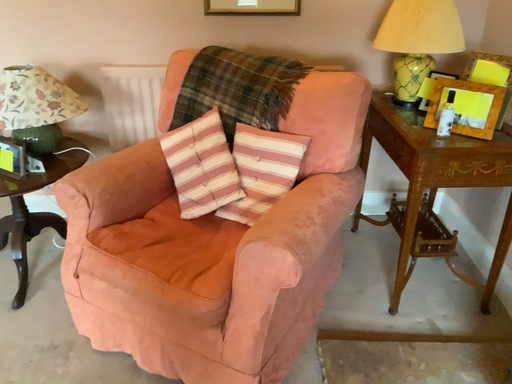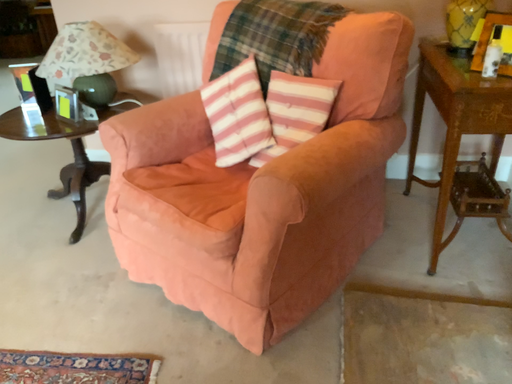
Question: Which way did the camera rotate in the video?

Choices:
 (A) rotated left
 (B) rotated right

Answer: (A)